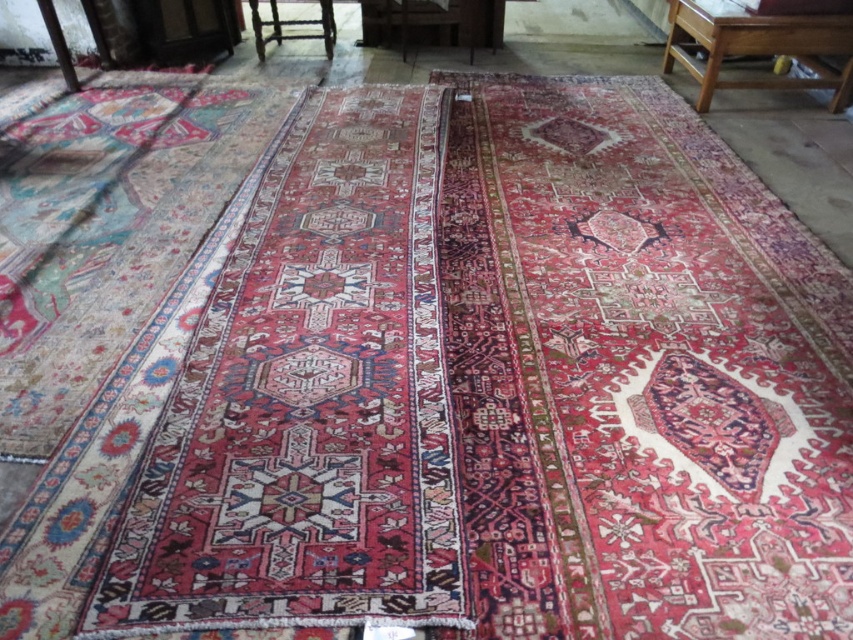
Is wooden table at upper right above wooden chair at upper center?

Incorrect, wooden table at upper right is not positioned above wooden chair at upper center.

How much distance is there between wooden table at upper right and wooden chair at upper center?

wooden table at upper right and wooden chair at upper center are 7.36 feet apart.

Who is more distant from viewer, (828, 40) or (323, 28)?

Positioned behind is point (323, 28).

Where is `wooden table at upper right`? Image resolution: width=853 pixels, height=640 pixels. wooden table at upper right is located at coordinates (758, 45).

Can you confirm if wooden chair at upper center is positioned below wooden chair at center?

No.

Who is lower down, wooden chair at upper center or wooden chair at center?

wooden chair at center

Find the location of `wooden chair at upper center`. wooden chair at upper center is located at coordinates (292, 24).

Can you confirm if wooden table at upper right is thinner than wooden chair at center?

In fact, wooden table at upper right might be wider than wooden chair at center.

Measure the distance between point (671, 48) and camera.

Point (671, 48) is 15.04 feet away from camera.

Where is `wooden table at upper right`? The width and height of the screenshot is (853, 640). wooden table at upper right is located at coordinates (758, 45).